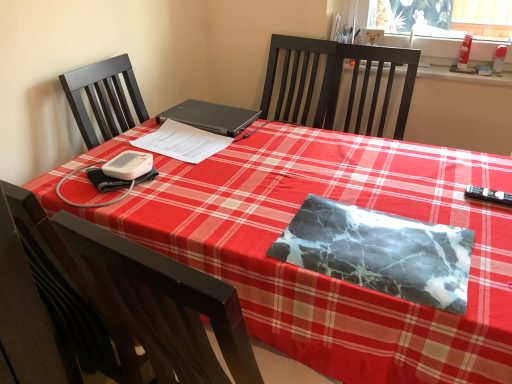
What do you see at coordinates (380, 252) in the screenshot? This screenshot has width=512, height=384. I see `marble-patterned notebook at center, the first notebook when ordered from front to back` at bounding box center [380, 252].

What is the approximate width of dark wood chair at lower left?

20.34 centimeters.

The height and width of the screenshot is (384, 512). Find the location of `white paper at center, marked as the 1th notebook in a back-to-front arrangement`. white paper at center, marked as the 1th notebook in a back-to-front arrangement is located at coordinates (183, 142).

Does white paper at center, which is the second notebook from right to left, have a lesser width compared to black matte laptop at center?

Yes.

Does white paper at center, which appears as the first notebook when viewed from the left, have a greater height compared to black matte laptop at center?

Incorrect, the height of white paper at center, which appears as the first notebook when viewed from the left, is not larger of that of black matte laptop at center.

From a real-world perspective, which is physically above, white paper at center, which appears as the first notebook when viewed from the left, or black matte laptop at center?

In real-world perspective, black matte laptop at center is above.

From the image's perspective, which object appears higher, white paper at center, which appears as the 1th notebook when viewed from the top, or black matte laptop at center?

black matte laptop at center is shown above in the image.

Is black matte laptop at center at the left side of white paper at center, arranged as the 2th notebook when viewed from the front?

Incorrect, black matte laptop at center is not on the left side of white paper at center, arranged as the 2th notebook when viewed from the front.

Identify the location of notebook on the left side of black matte laptop at center. This screenshot has height=384, width=512. (183, 142).

Looking at this image, how far apart are black matte laptop at center and white paper at center, arranged as the 2th notebook when viewed from the front?

black matte laptop at center is 3.97 inches away from white paper at center, arranged as the 2th notebook when viewed from the front.

Could you tell me if black matte laptop at center is facing white paper at center, arranged as the 2th notebook when viewed from the front?

No, black matte laptop at center does not turn towards white paper at center, arranged as the 2th notebook when viewed from the front.

Does marble-patterned notebook at center, which is counted as the 1th notebook, starting from the bottom, have a lesser height compared to black plastic remote control at right?

Indeed, marble-patterned notebook at center, which is counted as the 1th notebook, starting from the bottom, has a lesser height compared to black plastic remote control at right.

Measure the distance between marble-patterned notebook at center, the second notebook in the back-to-front sequence, and black plastic remote control at right.

marble-patterned notebook at center, the second notebook in the back-to-front sequence, is 15.15 inches away from black plastic remote control at right.

From the image's perspective, which is above, marble-patterned notebook at center, which is counted as the 1th notebook, starting from the bottom, or black plastic remote control at right?

black plastic remote control at right is shown above in the image.

Looking at their sizes, would you say marble-patterned notebook at center, which is the second notebook in top-to-bottom order, is wider or thinner than black plastic remote control at right?

marble-patterned notebook at center, which is the second notebook in top-to-bottom order, is wider than black plastic remote control at right.

Could marble-patterned notebook at center, which is the second notebook in top-to-bottom order, be considered to be inside white paper at center, which appears as the first notebook when viewed from the left?

Definitely not — marble-patterned notebook at center, which is the second notebook in top-to-bottom order, is not inside white paper at center, which appears as the first notebook when viewed from the left.

Is there a large distance between white paper at center, marked as the 1th notebook in a back-to-front arrangement, and marble-patterned notebook at center, which is counted as the 1th notebook, starting from the bottom?

No, there isn't a large distance between white paper at center, marked as the 1th notebook in a back-to-front arrangement, and marble-patterned notebook at center, which is counted as the 1th notebook, starting from the bottom.

Is white paper at center, which appears as the first notebook when viewed from the left, bigger than marble-patterned notebook at center, which is counted as the 1th notebook, starting from the bottom?

Actually, white paper at center, which appears as the first notebook when viewed from the left, might be smaller than marble-patterned notebook at center, which is counted as the 1th notebook, starting from the bottom.

Could you measure the distance between white paper at center, which appears as the first notebook when viewed from the left, and marble-patterned notebook at center, placed as the 1th notebook when sorted from right to left?

white paper at center, which appears as the first notebook when viewed from the left, and marble-patterned notebook at center, placed as the 1th notebook when sorted from right to left, are 24.28 inches apart.

Identify the location of chair located in front of the black matte laptop at center. The height and width of the screenshot is (384, 512). (130, 300).

Consider the image. Who is taller, dark wood chair at lower left or black matte laptop at center?

dark wood chair at lower left.

Is dark wood chair at lower left next to black matte laptop at center?

No, dark wood chair at lower left is not touching black matte laptop at center.

From a real-world perspective, which is physically below, dark wood chair at lower left or black matte laptop at center?

dark wood chair at lower left.

In the scene shown: Is dark wood chair at lower left oriented towards white paper at center, which appears as the 1th notebook when viewed from the top?

Yes.

Is dark wood chair at lower left positioned beyond the bounds of white paper at center, the second notebook from the bottom?

Yes, dark wood chair at lower left is outside of white paper at center, the second notebook from the bottom.

Is dark wood chair at lower left at the left side of white paper at center, arranged as the 2th notebook when viewed from the front?

Correct, you'll find dark wood chair at lower left to the left of white paper at center, arranged as the 2th notebook when viewed from the front.

From a real-world perspective, which is physically above, dark wood chair at lower left or white paper at center, which is the second notebook from right to left?

From a 3D spatial view, white paper at center, which is the second notebook from right to left, is above.

How different are the orientations of black plastic remote control at right and black matte laptop at center in degrees?

8.71e-05 degrees.

Considering their positions, is black plastic remote control at right located in front of or behind black matte laptop at center?

black plastic remote control at right is in front of black matte laptop at center.

Does point (490, 202) lie behind point (207, 108)?

No, it is not.

Is black plastic remote control at right to the left of black matte laptop at center from the viewer's perspective?

No, black plastic remote control at right is not to the left of black matte laptop at center.

Find the location of `laptop on the right of white paper at center, which appears as the first notebook when viewed from the left`. laptop on the right of white paper at center, which appears as the first notebook when viewed from the left is located at coordinates (211, 117).

This screenshot has width=512, height=384. I want to click on laptop behind the white paper at center, which appears as the 1th notebook when viewed from the top, so click(x=211, y=117).

When comparing their distances from marble-patterned notebook at center, which is the second notebook in top-to-bottom order, does black matte laptop at center or dark wood chair at lower left seem further?

The object further to marble-patterned notebook at center, which is the second notebook in top-to-bottom order, is black matte laptop at center.

Estimate the real-world distances between objects in this image. Which object is closer to black matte laptop at center, marble-patterned notebook at center, which is the second notebook in top-to-bottom order, or white paper at center, marked as the 1th notebook in a back-to-front arrangement?

Based on the image, white paper at center, marked as the 1th notebook in a back-to-front arrangement, appears to be nearer to black matte laptop at center.

Looking at the image, which one is located further to black matte laptop at center, dark wood chair at lower left or black plastic remote control at right?

black plastic remote control at right is further to black matte laptop at center.

Based on their spatial positions, is dark wood chair at lower left or black matte laptop at center further from black plastic remote control at right?

dark wood chair at lower left lies further to black plastic remote control at right than the other object.

Considering their positions, is white paper at center, which is the second notebook from right to left, positioned further to marble-patterned notebook at center, the first notebook when ordered from front to back, than black plastic remote control at right?

Among the two, white paper at center, which is the second notebook from right to left, is located further to marble-patterned notebook at center, the first notebook when ordered from front to back.

Considering their positions, is white paper at center, which is the second notebook from right to left, positioned closer to black plastic remote control at right than marble-patterned notebook at center, which is the second notebook in top-to-bottom order?

Based on the image, marble-patterned notebook at center, which is the second notebook in top-to-bottom order, appears to be nearer to black plastic remote control at right.

Based on their spatial positions, is black plastic remote control at right or dark wood chair at lower left further from marble-patterned notebook at center, the first notebook when ordered from front to back?

dark wood chair at lower left lies further to marble-patterned notebook at center, the first notebook when ordered from front to back, than the other object.

Estimate the real-world distances between objects in this image. Which object is further from black plastic remote control at right, black matte laptop at center or white paper at center, arranged as the 2th notebook when viewed from the front?

black matte laptop at center lies further to black plastic remote control at right than the other object.

The width and height of the screenshot is (512, 384). Identify the location of chair between marble-patterned notebook at center, which is counted as the 1th notebook, starting from the bottom, and black matte laptop at center in the front-back direction. 130,300.

Locate an element on the screen. The image size is (512, 384). notebook between black matte laptop at center and black plastic remote control at right is located at coordinates (380, 252).

Locate an element on the screen. The height and width of the screenshot is (384, 512). notebook located between dark wood chair at lower left and marble-patterned notebook at center, which is the second notebook in top-to-bottom order, in the left-right direction is located at coordinates (183, 142).

At what (x,y) coordinates should I click in order to perform the action: click on laptop between dark wood chair at lower left and black plastic remote control at right. Please return your answer as a coordinate pair (x, y). Looking at the image, I should click on 211,117.